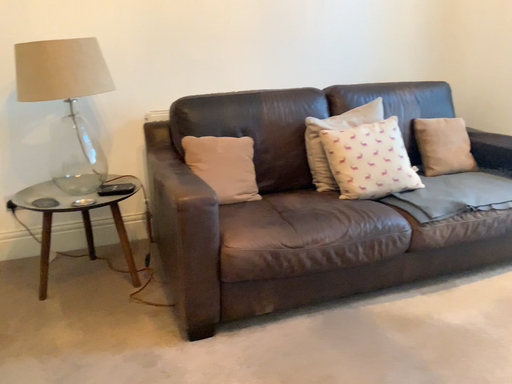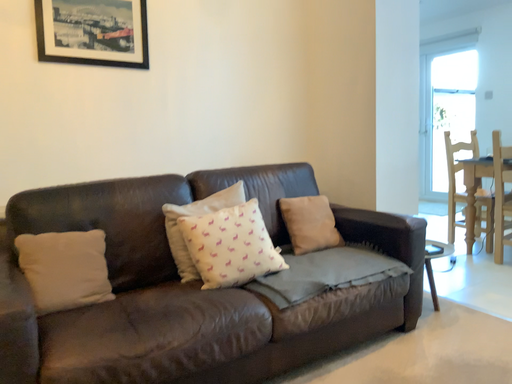
Question: Which way did the camera rotate in the video?

Choices:
 (A) rotated right
 (B) rotated left

Answer: (A)